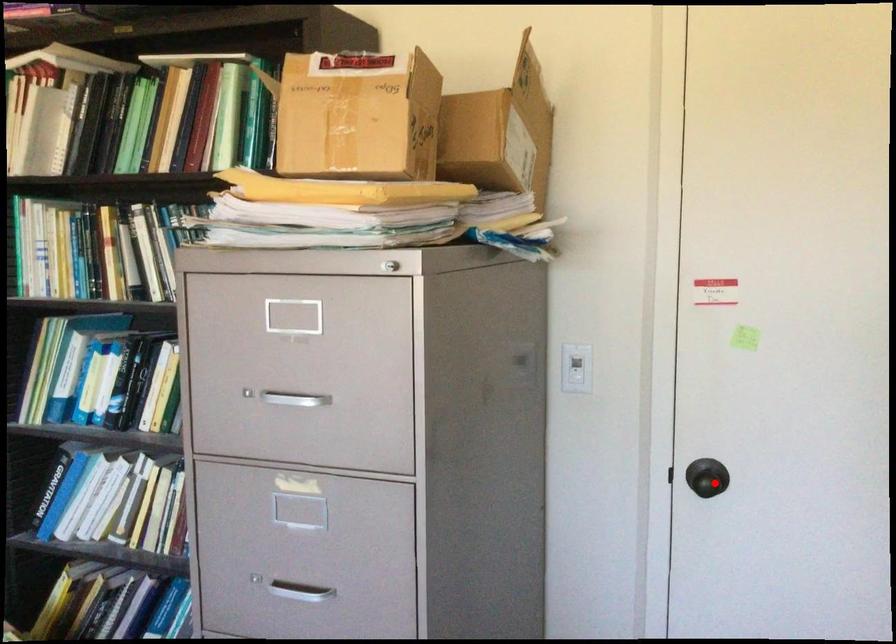
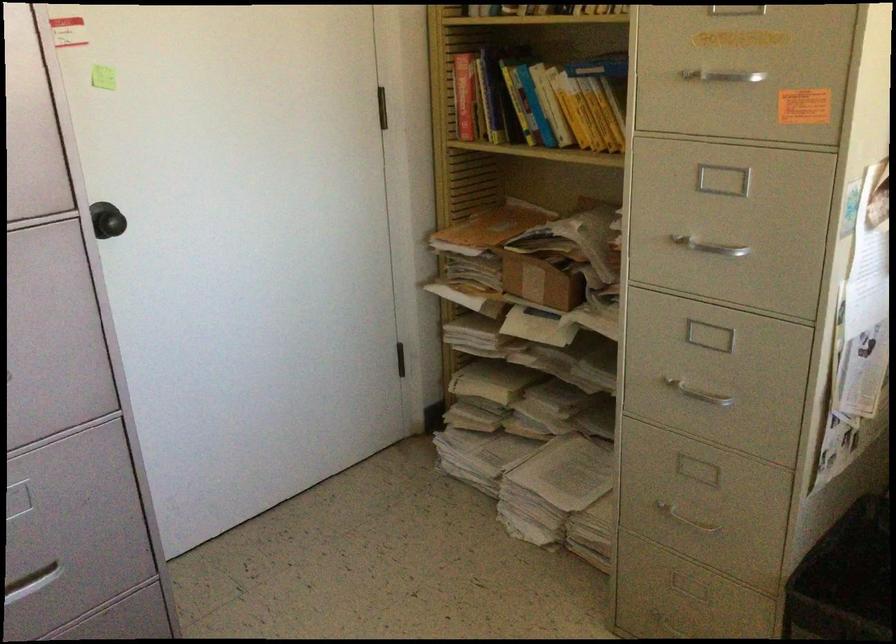
Find the pixel in the second image that matches the highlighted location in the first image.

(115, 223)